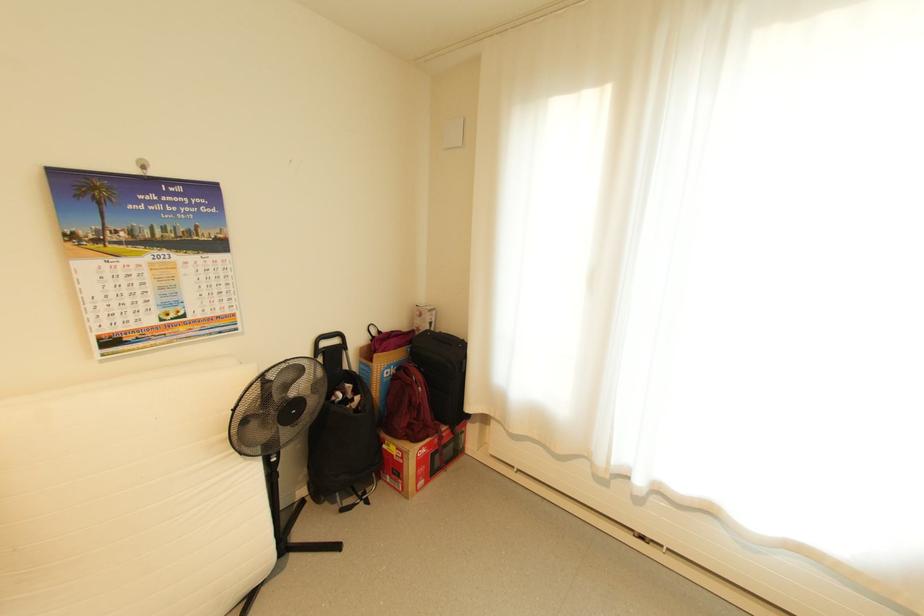
You are a GUI agent. You are given a task and a screenshot of the screen. Output one action in this format:
    pyautogui.click(x=<x>, y=<y>)
    Task: Click on the luggage cart handle
    Image resolution: width=924 pixels, height=616 pixels.
    Given the screenshot: What is the action you would take?
    pyautogui.click(x=329, y=342)